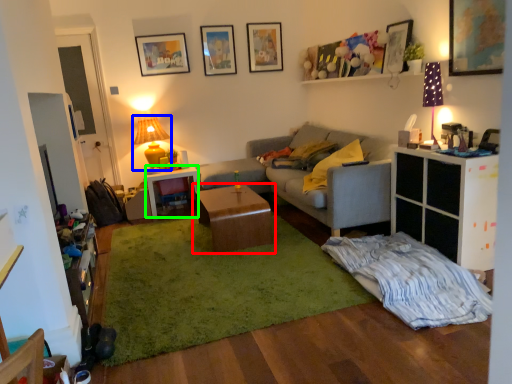
Question: Which object is the closest to the table (highlighted by a red box)? Choose among these: lamp (highlighted by a blue box) or desk (highlighted by a green box).

Choices:
 (A) lamp
 (B) desk

Answer: (B)